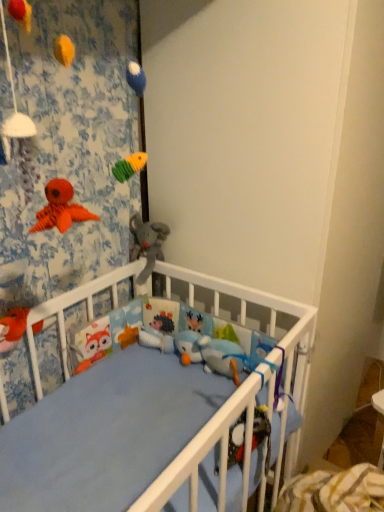
What do you see at coordinates (246, 134) in the screenshot?
I see `white matte wall at upper center` at bounding box center [246, 134].

What do you see at coordinates (12, 328) in the screenshot?
I see `fluffy orange fox at lower left, which is the second toy in top-to-bottom order` at bounding box center [12, 328].

In order to face fluffy orange fox at lower left, which is the 3th toy in back-to-front order, should I rotate leftwards or rightwards?

Rotate your view left by about 22.606°.

You are a GUI agent. You are given a task and a screenshot of the screen. Output one action in this format:
    pyautogui.click(x=<x>, y=<y>)
    Task: Click on the white plush hedgehog at center, placed as the 3th toy when sorted from top to bottom
    The width and height of the screenshot is (384, 512).
    Given the screenshot: What is the action you would take?
    pyautogui.click(x=146, y=338)

From the image's perspective, which is below, fluffy orange fox at lower left, acting as the 2th toy starting from the bottom, or white plush hedgehog at center, the 3th toy from the left?

white plush hedgehog at center, the 3th toy from the left, appears lower in the image.

The image size is (384, 512). What are the coordinates of `toy that is the 1st object above the white plush hedgehog at center, the 3th toy from the left (from a real-world perspective)` in the screenshot? It's located at (12, 328).

How much distance is there between fluffy orange fox at lower left, which is the 3th toy in back-to-front order, and white plush hedgehog at center, positioned as the 1th toy in right-to-left order?

A distance of 13.33 inches exists between fluffy orange fox at lower left, which is the 3th toy in back-to-front order, and white plush hedgehog at center, positioned as the 1th toy in right-to-left order.

Which is correct: fluffy orange fox at lower left, which is the second toy in top-to-bottom order, is inside white plush hedgehog at center, the 3th toy from the left, or outside of it?

fluffy orange fox at lower left, which is the second toy in top-to-bottom order, is not inside white plush hedgehog at center, the 3th toy from the left, it's outside.

From a real-world perspective, is soft plush elephant at center, which ranks as the third toy in bottom-to-top order, located higher than white plush hedgehog at center, positioned as the 1th toy in bottom-to-top order?

Correct, in the physical world, soft plush elephant at center, which ranks as the third toy in bottom-to-top order, is higher than white plush hedgehog at center, positioned as the 1th toy in bottom-to-top order.

Considering the sizes of soft plush elephant at center, which ranks as the third toy in bottom-to-top order, and white plush hedgehog at center, the 3th toy from the left, in the image, is soft plush elephant at center, which ranks as the third toy in bottom-to-top order, taller or shorter than white plush hedgehog at center, the 3th toy from the left,?

soft plush elephant at center, which ranks as the third toy in bottom-to-top order, is taller than white plush hedgehog at center, the 3th toy from the left.

Would you say soft plush elephant at center, the second toy viewed from the front, is outside white plush hedgehog at center, placed as the 3th toy when sorted from front to back?

That's correct, soft plush elephant at center, the second toy viewed from the front, is outside of white plush hedgehog at center, placed as the 3th toy when sorted from front to back.

Is white plush hedgehog at center, placed as the 3th toy when sorted from top to bottom, inside white matte wall at upper center?

No, white plush hedgehog at center, placed as the 3th toy when sorted from top to bottom, is not surrounded by white matte wall at upper center.

Is white plush hedgehog at center, positioned as the 1th toy in bottom-to-top order, at the back of white matte wall at upper center?

No, white plush hedgehog at center, positioned as the 1th toy in bottom-to-top order, is not at the back of white matte wall at upper center.

Image resolution: width=384 pixels, height=512 pixels. I want to click on the 1st toy to the left of the white matte wall at upper center, starting your count from the anchor, so click(146, 338).

From their relative heights in the image, would you say white matte wall at upper center is taller or shorter than white plush hedgehog at center, positioned as the 1th toy in bottom-to-top order?

white matte wall at upper center is taller than white plush hedgehog at center, positioned as the 1th toy in bottom-to-top order.

What's the angular difference between fluffy orange fox at lower left, which is the 3th toy in back-to-front order, and soft plush elephant at center, the 2th toy from the right,'s facing directions?

92.3 degrees separate the facing orientations of fluffy orange fox at lower left, which is the 3th toy in back-to-front order, and soft plush elephant at center, the 2th toy from the right.

From the image's perspective, which one is positioned higher, fluffy orange fox at lower left, placed as the first toy when sorted from left to right, or soft plush elephant at center, which ranks as the third toy in bottom-to-top order?

soft plush elephant at center, which ranks as the third toy in bottom-to-top order, from the image's perspective.

Between fluffy orange fox at lower left, acting as the 2th toy starting from the bottom, and soft plush elephant at center, the 2th toy when ordered from left to right, which one has smaller size?

fluffy orange fox at lower left, acting as the 2th toy starting from the bottom, is smaller.

Could you tell me if fluffy orange fox at lower left, acting as the 3th toy starting from the right, is turned towards soft plush elephant at center, which ranks as the third toy in bottom-to-top order?

No, fluffy orange fox at lower left, acting as the 3th toy starting from the right, is not aimed at soft plush elephant at center, which ranks as the third toy in bottom-to-top order.

In the image, is soft plush elephant at center, the 2th toy when ordered from left to right, on the left side or the right side of fluffy orange fox at lower left, which is the 3th toy in back-to-front order?

From the image, it's evident that soft plush elephant at center, the 2th toy when ordered from left to right, is to the right of fluffy orange fox at lower left, which is the 3th toy in back-to-front order.

Considering the points (151, 272) and (4, 317), which point is in front, point (151, 272) or point (4, 317)?

The point (4, 317) is closer to the camera.

Can we say soft plush elephant at center, the second toy viewed from the front, lies outside fluffy orange fox at lower left, which is the second toy in top-to-bottom order?

Yes.

Is soft plush elephant at center, the 2th toy when ordered from left to right, facing away from fluffy orange fox at lower left, acting as the 3th toy starting from the right?

soft plush elephant at center, the 2th toy when ordered from left to right, does not have its back to fluffy orange fox at lower left, acting as the 3th toy starting from the right.

Is soft plush elephant at center, the 2th toy when ordered from left to right, completely or partially inside white plush hedgehog at center, placed as the 3th toy when sorted from top to bottom?

No, soft plush elephant at center, the 2th toy when ordered from left to right, is not a part of white plush hedgehog at center, placed as the 3th toy when sorted from top to bottom.

Looking at this image, is white plush hedgehog at center, placed as the 3th toy when sorted from top to bottom, turned away from soft plush elephant at center, the 2th toy from the right?

No.

Considering the points (156, 334) and (141, 284), which point is in front, point (156, 334) or point (141, 284)?

The point (156, 334) is more forward.

Which is behind, white plush hedgehog at center, positioned as the 1th toy in bottom-to-top order, or soft plush elephant at center, which is counted as the second toy, starting from the back?

white plush hedgehog at center, positioned as the 1th toy in bottom-to-top order, is further away from the camera.

From the image's perspective, is white plush hedgehog at center, the 3th toy from the left, above or below white matte wall at upper center?

From the image's perspective, white plush hedgehog at center, the 3th toy from the left, appears below white matte wall at upper center.

Which of these two, white plush hedgehog at center, which appears as the first toy when viewed from the back, or white matte wall at upper center, is bigger?

white matte wall at upper center is bigger.

In the scene shown: Is white matte wall at upper center at the back of white plush hedgehog at center, which appears as the first toy when viewed from the back?

Yes, white matte wall at upper center is at the back of white plush hedgehog at center, which appears as the first toy when viewed from the back.

Can you confirm if white plush hedgehog at center, which appears as the first toy when viewed from the back, is positioned to the left of white matte wall at upper center?

Yes.

Starting from the fluffy orange fox at lower left, acting as the 3th toy starting from the right, which toy is the 2nd one to the right? Please provide its 2D coordinates.

[(146, 338)]

Find the location of a particular element. Image resolution: width=384 pixels, height=512 pixels. the 2nd toy positioned above the white plush hedgehog at center, placed as the 3th toy when sorted from top to bottom (from a real-world perspective) is located at coordinates (147, 243).

Looking at the image, which one is located further to white plush hedgehog at center, the 3th toy from the left, fluffy orange fox at lower left, acting as the 3th toy starting from the right, or soft plush elephant at center, the 2th toy from the right?

fluffy orange fox at lower left, acting as the 3th toy starting from the right, lies further to white plush hedgehog at center, the 3th toy from the left, than the other object.

Which object lies further to the anchor point white matte wall at upper center, white plush hedgehog at center, positioned as the 1th toy in right-to-left order, or soft plush elephant at center, which is counted as the second toy, starting from the back?

white plush hedgehog at center, positioned as the 1th toy in right-to-left order.

From the image, which object appears to be farther from white matte wall at upper center, white plush hedgehog at center, positioned as the 1th toy in bottom-to-top order, or fluffy orange fox at lower left, acting as the 2th toy starting from the bottom?

fluffy orange fox at lower left, acting as the 2th toy starting from the bottom.

Considering their positions, is soft plush elephant at center, the 2th toy from the right, positioned closer to white plush hedgehog at center, which appears as the first toy when viewed from the back, than fluffy orange fox at lower left, acting as the 3th toy starting from the right?

soft plush elephant at center, the 2th toy from the right, is positioned closer to the anchor white plush hedgehog at center, which appears as the first toy when viewed from the back.

Considering their positions, is soft plush elephant at center, the second toy viewed from the front, positioned closer to fluffy orange fox at lower left, acting as the 2th toy starting from the bottom, than white matte wall at upper center?

soft plush elephant at center, the second toy viewed from the front, lies closer to fluffy orange fox at lower left, acting as the 2th toy starting from the bottom, than the other object.

Which object lies nearer to the anchor point white matte wall at upper center, soft plush elephant at center, positioned as the 1th toy in top-to-bottom order, or white plush hedgehog at center, placed as the 3th toy when sorted from top to bottom?

soft plush elephant at center, positioned as the 1th toy in top-to-bottom order.

Considering their positions, is fluffy orange fox at lower left, which is the 3th toy in back-to-front order, positioned further to white matte wall at upper center than white plush hedgehog at center, placed as the 3th toy when sorted from top to bottom?

fluffy orange fox at lower left, which is the 3th toy in back-to-front order.

Looking at the image, which one is located closer to soft plush elephant at center, which ranks as the third toy in bottom-to-top order, fluffy orange fox at lower left, which is the second toy in top-to-bottom order, or white plush hedgehog at center, the 3th toy from the left?

white plush hedgehog at center, the 3th toy from the left, is positioned closer to the anchor soft plush elephant at center, which ranks as the third toy in bottom-to-top order.

Locate an element on the screen. toy between fluffy orange fox at lower left, positioned as the 1th toy in front-to-back order, and white plush hedgehog at center, the 3th toy from the left, in the front-back direction is located at coordinates (147, 243).

You are a GUI agent. You are given a task and a screenshot of the screen. Output one action in this format:
    pyautogui.click(x=<x>, y=<y>)
    Task: Click on the toy situated between soft plush elephant at center, positioned as the 1th toy in top-to-bottom order, and white matte wall at upper center from left to right
    The image size is (384, 512).
    Given the screenshot: What is the action you would take?
    pyautogui.click(x=146, y=338)